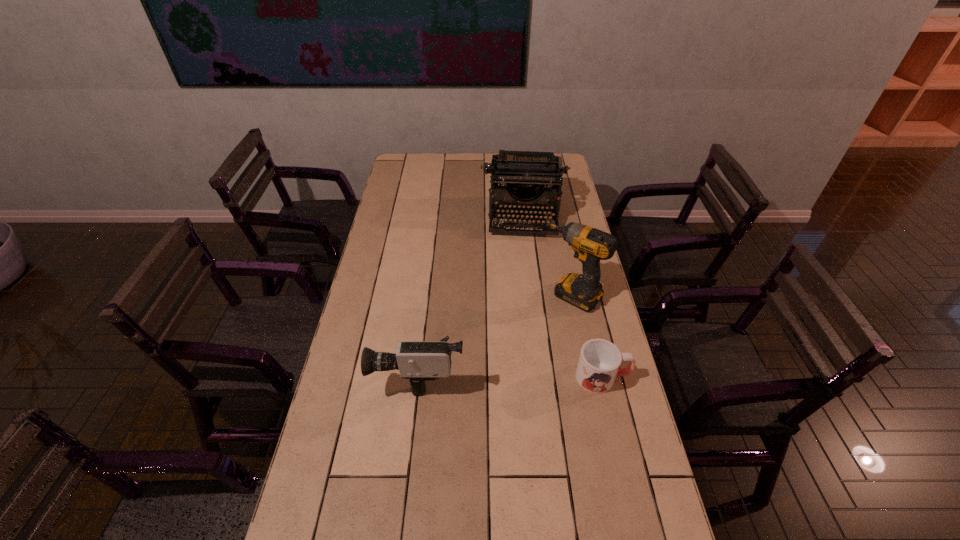
You are a GUI agent. You are given a task and a screenshot of the screen. Output one action in this format:
    pyautogui.click(x=<x>, y=<y>)
    Task: Click on the vacant space on the desktop that is between the leftmost object and the mug and is positioned with the drill bit of the tallest object facing forward
    This screenshot has height=540, width=960.
    Given the screenshot: What is the action you would take?
    pyautogui.click(x=507, y=375)

Identify the location of vacant space on the desktop that is between the camcorder and the mug and is positioned on the typing side of the typewriter. The image size is (960, 540). (525, 375).